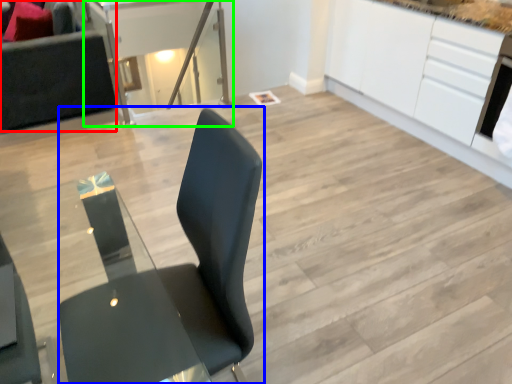
Question: Which object is the farthest from couch (highlighted by a red box)? Choose among these: chair (highlighted by a blue box) or table (highlighted by a green box).

Choices:
 (A) chair
 (B) table

Answer: (A)